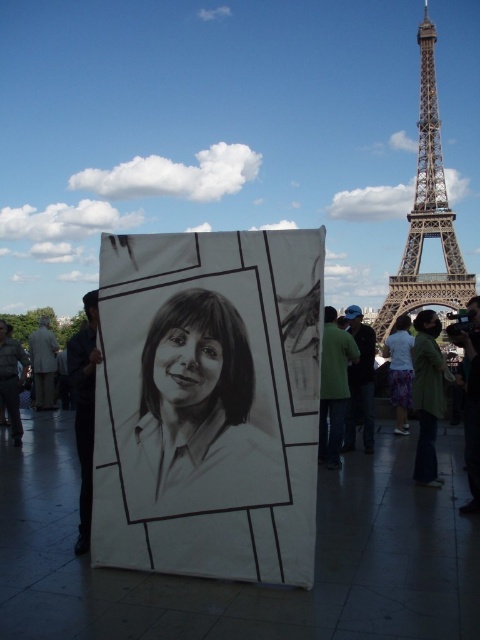
Question: Which point is farther from the camera taking this photo?

Choices:
 (A) (285, 451)
 (B) (427, 109)
 (C) (396, 320)
 (D) (286, 468)

Answer: (B)

Question: Does brown metal eiffel tower at right have a lesser width compared to white cotton dress at center-right?

Choices:
 (A) yes
 (B) no

Answer: (B)

Question: Which object appears farthest from the camera in this image?

Choices:
 (A) brown metal eiffel tower at right
 (B) pencil sketch portrait at center
 (C) white cotton dress at center-right
 (D) pencil drawing portrait at center

Answer: (C)

Question: Is brown metal eiffel tower at right wider than white cotton dress at center-right?

Choices:
 (A) no
 (B) yes

Answer: (B)

Question: Which point is closer to the camera?

Choices:
 (A) brown metal eiffel tower at right
 (B) white cotton dress at center-right
 (C) pencil drawing portrait at center

Answer: (A)

Question: Is brown metal eiffel tower at right below white cotton dress at center-right?

Choices:
 (A) no
 (B) yes

Answer: (A)